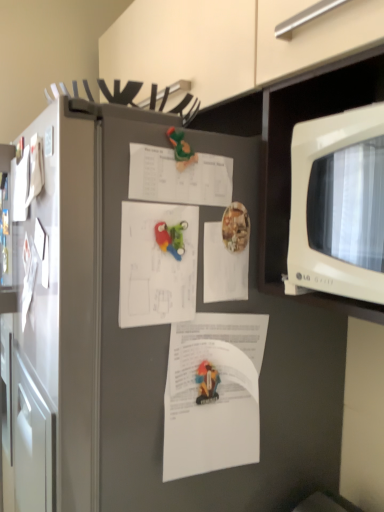
Question: Is white paper at center, which is the 3th document in bottom-to-top order, situated inside rubberized plastic toy at center, placed as the 1th toy when sorted from bottom to top, or outside?

Choices:
 (A) inside
 (B) outside

Answer: (B)

Question: Considering the positions of white paper at center, the second document in the top-to-bottom sequence, and rubberized plastic toy at center, which ranks as the second toy in top-to-bottom order, in the image, is white paper at center, the second document in the top-to-bottom sequence, wider or thinner than rubberized plastic toy at center, which ranks as the second toy in top-to-bottom order,?

Choices:
 (A) thin
 (B) wide

Answer: (A)

Question: Estimate the real-world distances between objects in this image. Which object is closer to the rubberized plastic toy at center, placed as the 1th toy when sorted from bottom to top?

Choices:
 (A) white paper at upper center, positioned as the 1th document in top-to-bottom order
 (B) white paper at center, the second document in the top-to-bottom sequence
 (C) white paper at center, which appears as the 4th document when viewed from the top
 (D) white paper at center, acting as the 2th document starting from the bottom
 (E) white glossy microwave at right

Answer: (D)

Question: Based on their relative distances, which object is nearer to the green plastic toy at center, the 2th toy from the bottom?

Choices:
 (A) white paper at center, acting as the 2th document starting from the bottom
 (B) white paper at upper center, positioned as the 1th document in top-to-bottom order
 (C) white glossy microwave at right
 (D) white paper at center, the second document in the top-to-bottom sequence
 (E) white paper at center, which is the 1th document from bottom to top

Answer: (B)